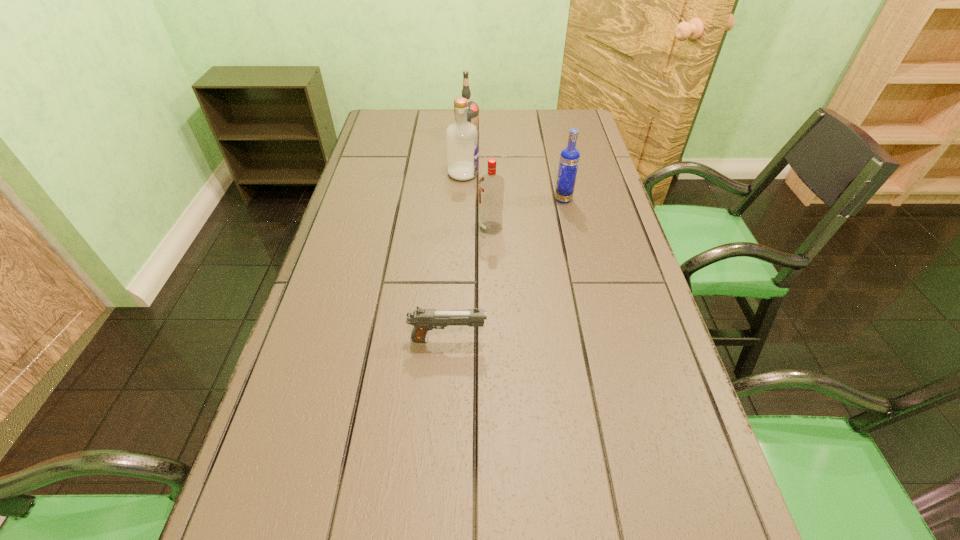
The height and width of the screenshot is (540, 960). I want to click on the second farthest object, so click(462, 143).

Find the location of a particular element. Image resolution: width=960 pixels, height=540 pixels. the farthest vodka is located at coordinates (473, 109).

The height and width of the screenshot is (540, 960). I want to click on the third farthest object, so click(569, 159).

Locate an element on the screen. This screenshot has width=960, height=540. the rightmost vodka is located at coordinates (569, 159).

At what (x,y) coordinates should I click in order to perform the action: click on the second nearest object. Please return your answer as a coordinate pair (x, y). Image resolution: width=960 pixels, height=540 pixels. Looking at the image, I should click on (491, 186).

Identify the location of the shortest object. The height and width of the screenshot is (540, 960). (423, 320).

Locate an element on the screen. This screenshot has width=960, height=540. gun is located at coordinates (423, 320).

Locate an element on the screen. The height and width of the screenshot is (540, 960). free space located on the label of the second farthest vodka is located at coordinates (552, 174).

You are a GUI agent. You are given a task and a screenshot of the screen. Output one action in this format:
    pyautogui.click(x=<x>, y=<y>)
    Task: Click on the vacant space located on the front label of the farthest object
    
    Given the screenshot: What is the action you would take?
    pyautogui.click(x=522, y=134)

What are the coordinates of `free space located on the left of the rightmost object` in the screenshot? It's located at (435, 199).